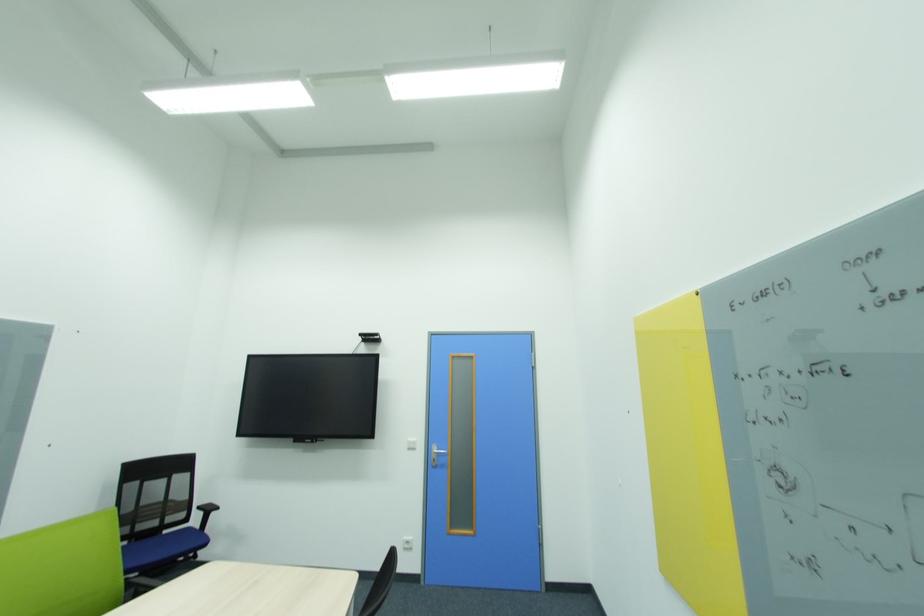
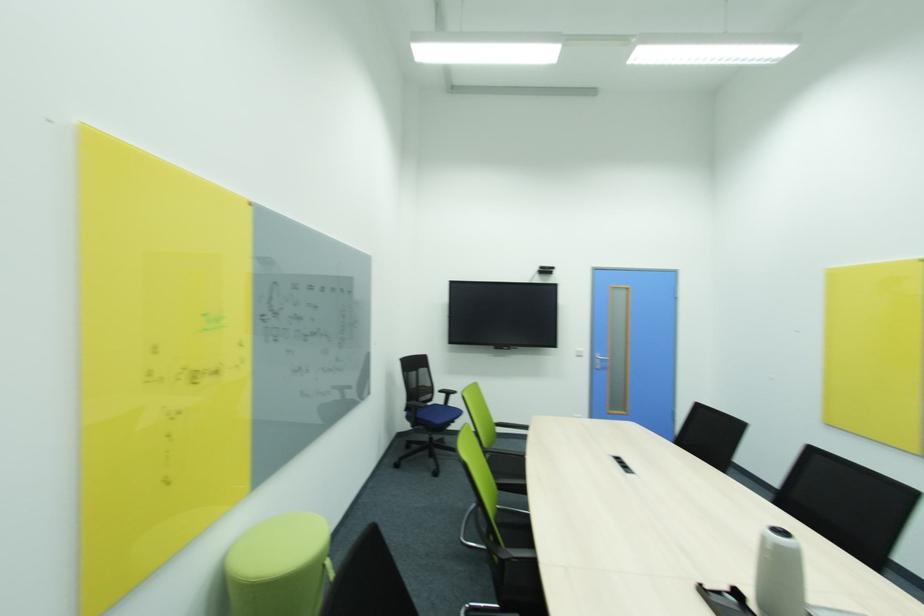
Where in the second image is the point corresponding to (x=185, y=479) from the first image?

(428, 371)